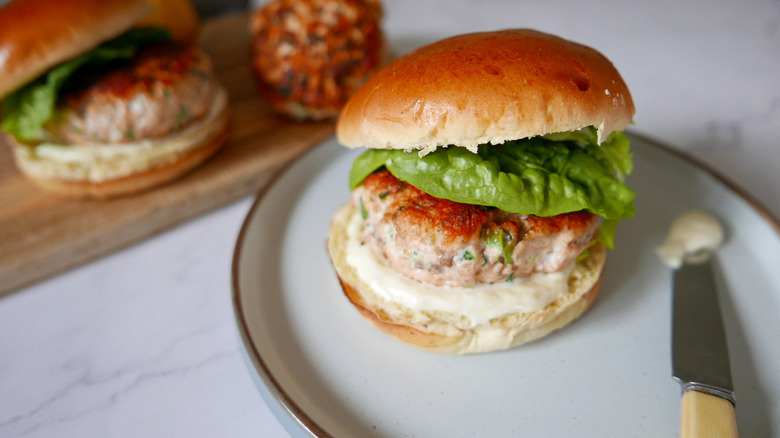
Locate an element on the screen. This screenshot has height=438, width=780. handle is located at coordinates (703, 413).